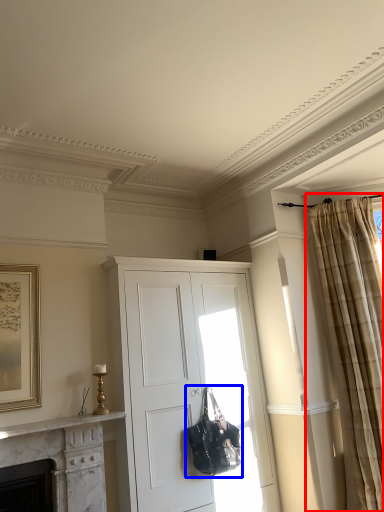
Question: Which object appears farthest to the camera in this image, curtain (highlighted by a red box) or handbag (highlighted by a blue box)?

Choices:
 (A) curtain
 (B) handbag

Answer: (A)